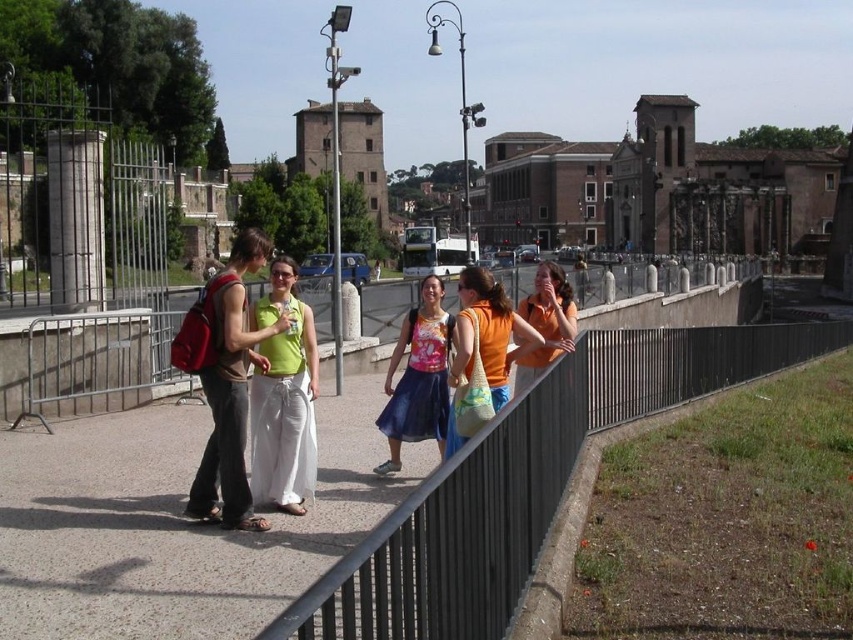
Question: Based on their relative distances, which object is nearer to the matte green dress at center?

Choices:
 (A) orange cotton shirt at center
 (B) metallic gray fence at center

Answer: (A)

Question: Does orange cotton tote bag at center appear under natural woven bag at center?

Choices:
 (A) yes
 (B) no

Answer: (B)

Question: Considering the relative positions of metallic gray fence at center and matte pink blouse at center in the image provided, where is metallic gray fence at center located with respect to matte pink blouse at center?

Choices:
 (A) left
 (B) right

Answer: (B)

Question: Which object appears closest to the camera in this image?

Choices:
 (A) matte green dress at center
 (B) orange cotton shirt at center
 (C) green fabric top at center
 (D) natural woven bag at center

Answer: (A)

Question: Is metallic gray fence at center below matte pink blouse at center?

Choices:
 (A) no
 (B) yes

Answer: (A)

Question: Which object is closer to the camera taking this photo?

Choices:
 (A) natural woven bag at center
 (B) matte green dress at center
 (C) metallic gray fence at center

Answer: (B)